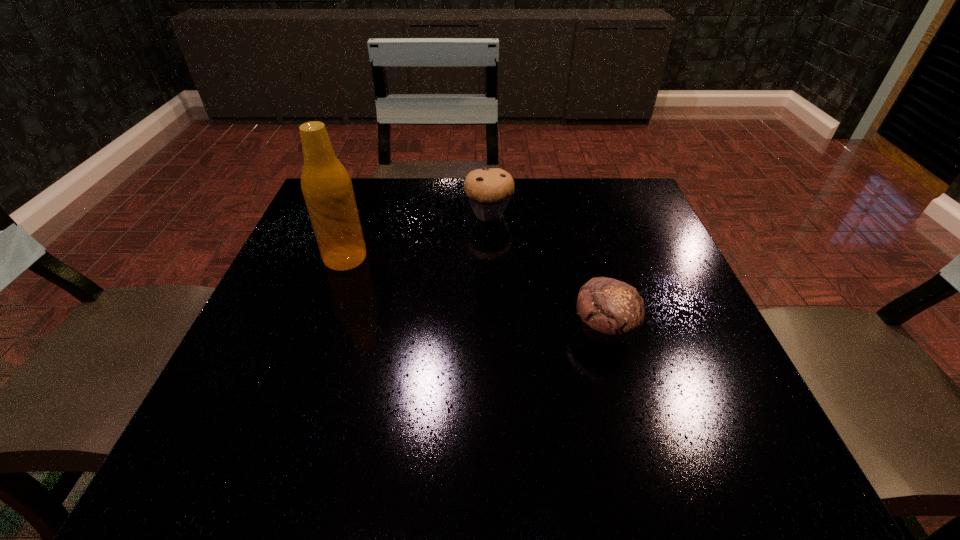
Locate an element on the screen. Image resolution: width=960 pixels, height=540 pixels. the leftmost object is located at coordinates (326, 186).

Find the location of a particular element. beer bottle is located at coordinates (326, 186).

I want to click on the left muffin, so click(x=489, y=190).

Find the location of a particular element. The image size is (960, 540). the farther muffin is located at coordinates (489, 190).

This screenshot has height=540, width=960. I want to click on the nearest object, so click(x=610, y=310).

Find the location of `the right muffin`. the right muffin is located at coordinates point(610,310).

The height and width of the screenshot is (540, 960). I want to click on vacant space located 0.360m on the right of the second nearest object, so click(x=533, y=258).

Where is `free region located on the right of the left muffin`? Image resolution: width=960 pixels, height=540 pixels. free region located on the right of the left muffin is located at coordinates (603, 214).

Where is `vacant region located on the left of the nearest object`? Image resolution: width=960 pixels, height=540 pixels. vacant region located on the left of the nearest object is located at coordinates (424, 330).

Where is `object located in the far edge section of the desktop`? This screenshot has height=540, width=960. object located in the far edge section of the desktop is located at coordinates (489, 190).